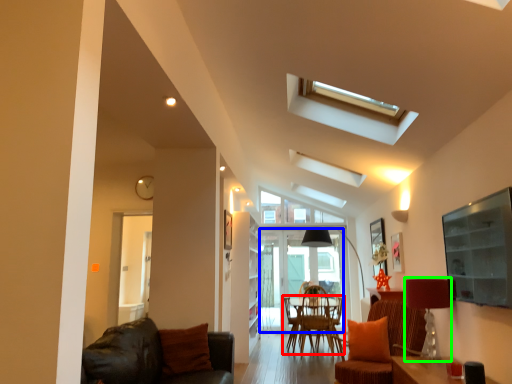
Question: Considering the real-world distances, which object is closest to chair (highlighted by a red box)? glass door (highlighted by a blue box) or lamp (highlighted by a green box).

Choices:
 (A) glass door
 (B) lamp

Answer: (A)